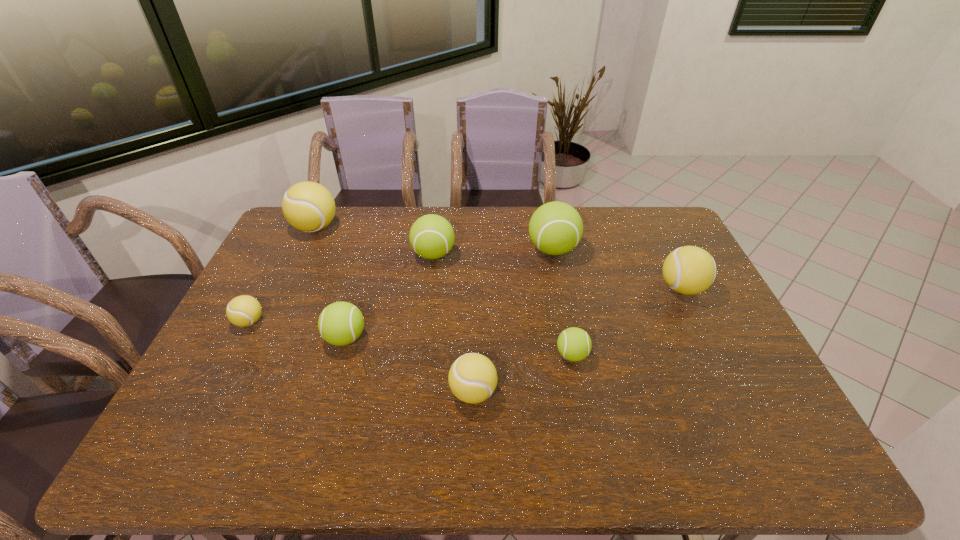
Locate an element on the screen. Image resolution: width=960 pixels, height=540 pixels. the smallest yellow tennis ball is located at coordinates (244, 310).

Locate an element on the screen. the smallest green tennis ball is located at coordinates (574, 344).

Where is `vacant space located on the right of the farthest yellow tennis ball`? vacant space located on the right of the farthest yellow tennis ball is located at coordinates (377, 227).

Identify the location of free space located 0.350m on the left of the biggest green tennis ball. The width and height of the screenshot is (960, 540). (427, 249).

Locate an element on the screen. The height and width of the screenshot is (540, 960). free space located on the front of the third green tennis ball from right to left is located at coordinates (430, 285).

The image size is (960, 540). Find the location of `vacant region located on the left of the fourth farthest object`. vacant region located on the left of the fourth farthest object is located at coordinates (601, 288).

Where is `free space located on the left of the second smallest green tennis ball`? free space located on the left of the second smallest green tennis ball is located at coordinates (222, 338).

Identify the location of free space located on the front of the third biggest yellow tennis ball. The width and height of the screenshot is (960, 540). (472, 462).

Identify the location of vacant space situated on the front of the smallest yellow tennis ball. The height and width of the screenshot is (540, 960). (188, 439).

Find the location of `free region located 0.110m on the back of the smallest green tennis ball`. free region located 0.110m on the back of the smallest green tennis ball is located at coordinates (564, 314).